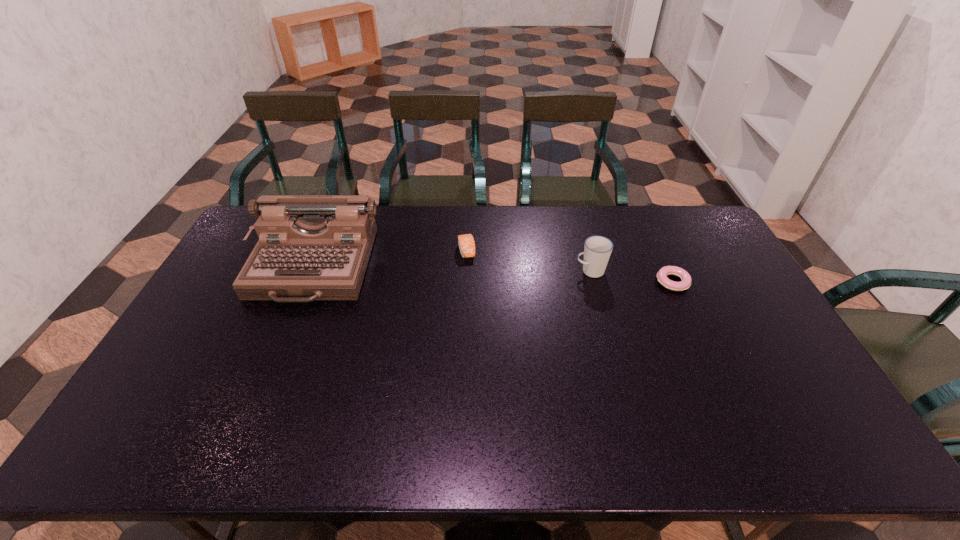
Identify the location of the leftmost object. (311, 247).

Locate an element on the screen. typewriter is located at coordinates (311, 247).

Image resolution: width=960 pixels, height=540 pixels. In order to click on cup in this screenshot , I will do `click(597, 249)`.

Locate an element on the screen. This screenshot has height=540, width=960. the third shortest object is located at coordinates coord(597,249).

In order to click on the third object from right to left in this screenshot , I will do `click(466, 243)`.

Locate an element on the screen. Image resolution: width=960 pixels, height=540 pixels. the second shortest object is located at coordinates (466, 243).

The image size is (960, 540). I want to click on doughnut, so click(x=685, y=283).

The width and height of the screenshot is (960, 540). In order to click on the shortest object in this screenshot , I will do `click(685, 283)`.

Locate an element on the screen. This screenshot has width=960, height=540. free spot located on the keyboard of the typewriter is located at coordinates (272, 363).

You are a GUI agent. You are given a task and a screenshot of the screen. Output one action in this format:
    pyautogui.click(x=<x>, y=<y>)
    Task: Click on the vacant space situated with a handle on the side of the second object from right to left
    The image size is (960, 540).
    Given the screenshot: What is the action you would take?
    pyautogui.click(x=542, y=271)